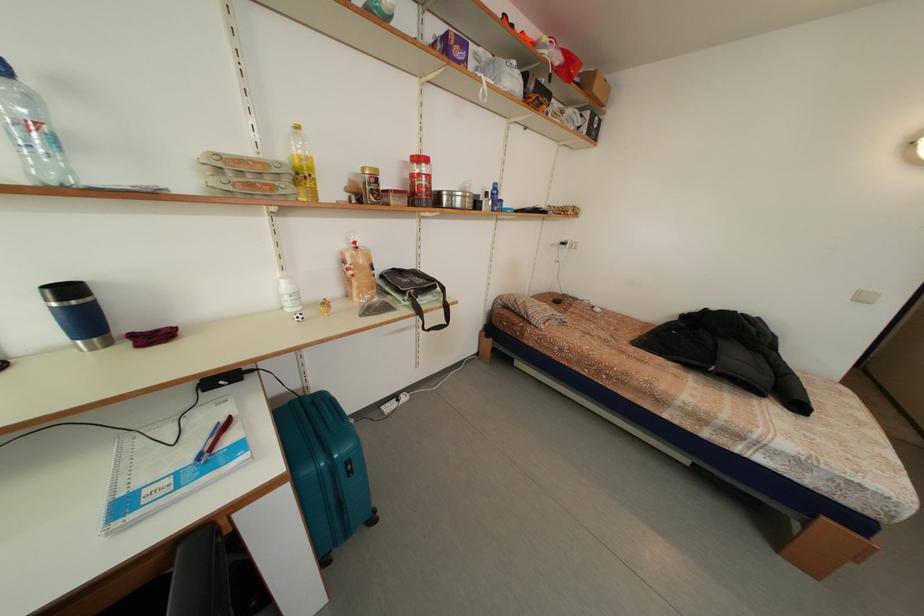
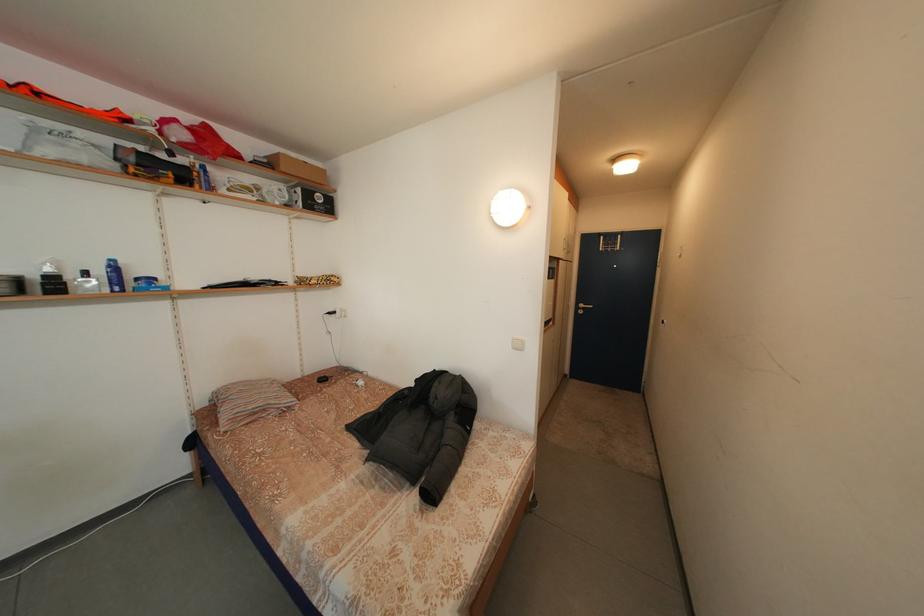
The point at (594, 119) is marked in the first image. Where is the corresponding point in the second image?

(307, 196)